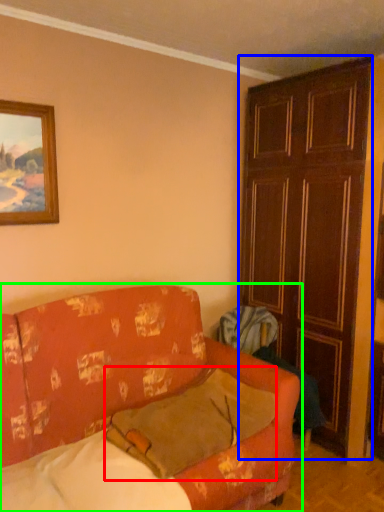
Question: Which object is positioned farthest from pillow (highlighted by a red box)? Select from door (highlighted by a blue box) and studio couch (highlighted by a green box).

Choices:
 (A) door
 (B) studio couch

Answer: (A)